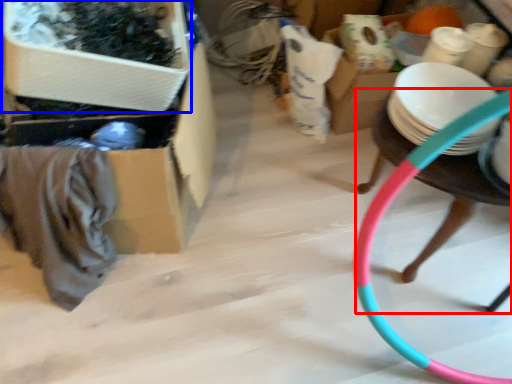
Question: Which object is further to the camera taking this photo, chair (highlighted by a red box) or storage box (highlighted by a blue box)?

Choices:
 (A) chair
 (B) storage box

Answer: (A)